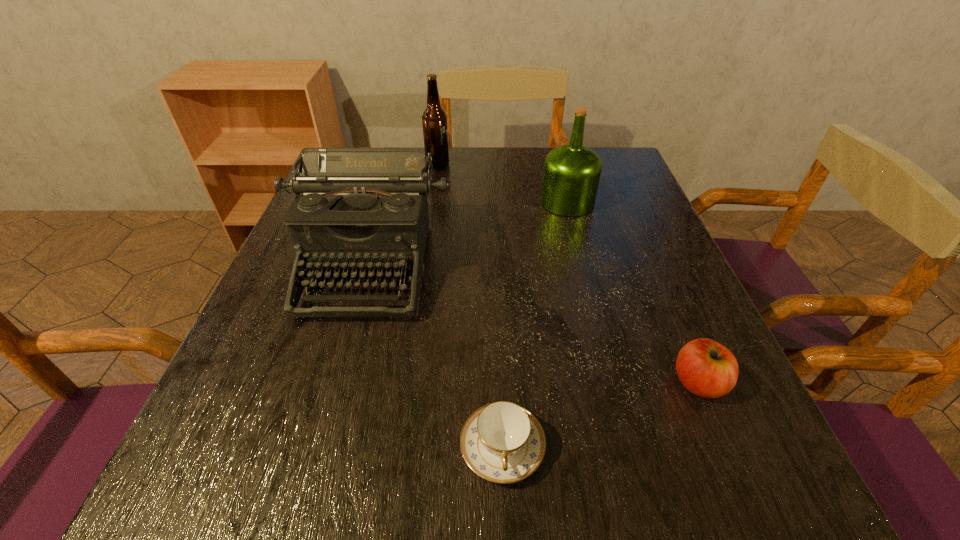
This screenshot has width=960, height=540. In order to click on vacant space that's between the fourth object from left to right and the third nearest object in this screenshot , I will do `click(468, 234)`.

The width and height of the screenshot is (960, 540). Find the location of `vacant space in between the shortest object and the beer bottle`. vacant space in between the shortest object and the beer bottle is located at coordinates (470, 307).

Where is `object that is the fourth closest to the farthest object`? The height and width of the screenshot is (540, 960). object that is the fourth closest to the farthest object is located at coordinates (706, 368).

The image size is (960, 540). Find the location of `object that is the fourth closest to the second object from right to left`. object that is the fourth closest to the second object from right to left is located at coordinates (502, 442).

This screenshot has width=960, height=540. I want to click on vacant space that satisfies the following two spatial constraints: 1. on the label of the fourth nearest object; 2. on the left side of the beer bottle, so click(x=433, y=202).

This screenshot has width=960, height=540. I want to click on blank space that satisfies the following two spatial constraints: 1. on the label of the farthest object; 2. on the right side of the olive oil, so (x=433, y=202).

Where is `free spot that satisfies the following two spatial constraints: 1. on the label of the farthest object; 2. on the typing side of the typewriter`? This screenshot has height=540, width=960. free spot that satisfies the following two spatial constraints: 1. on the label of the farthest object; 2. on the typing side of the typewriter is located at coordinates click(x=424, y=266).

Find the location of `blank area in the image that satisfies the following two spatial constraints: 1. on the typing side of the fourth farthest object; 2. on the right side of the typewriter`. blank area in the image that satisfies the following two spatial constraints: 1. on the typing side of the fourth farthest object; 2. on the right side of the typewriter is located at coordinates (336, 383).

Find the location of a particular element. blank space that satisfies the following two spatial constraints: 1. on the label of the beer bottle; 2. on the typing side of the third tallest object is located at coordinates (424, 266).